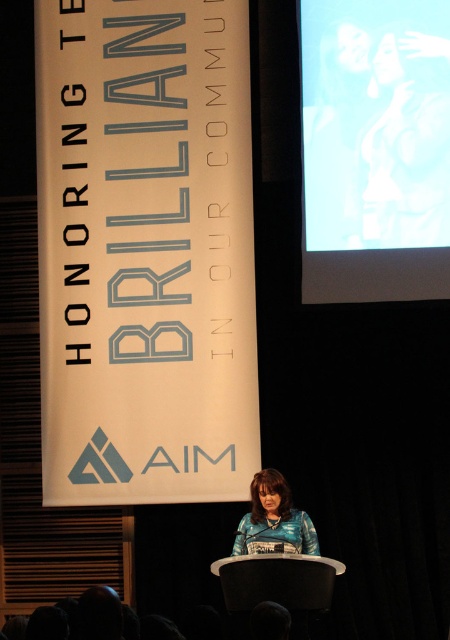
Question: Does white glossy screen at upper right appear on the right side of blue textured shirt at center?

Choices:
 (A) no
 (B) yes

Answer: (B)

Question: Which object appears closest to the camera in this image?

Choices:
 (A) blue textured shirt at center
 (B) white glossy screen at upper right

Answer: (A)

Question: Observing the image, what is the correct spatial positioning of white glossy screen at upper right in reference to blue textured shirt at center?

Choices:
 (A) left
 (B) right

Answer: (B)

Question: Which object is closer to the camera taking this photo?

Choices:
 (A) white glossy screen at upper right
 (B) blue textured shirt at center

Answer: (B)

Question: Which point is closer to the camera?

Choices:
 (A) (270, 518)
 (B) (374, 241)

Answer: (A)

Question: Is white glossy screen at upper right smaller than blue textured shirt at center?

Choices:
 (A) no
 (B) yes

Answer: (A)